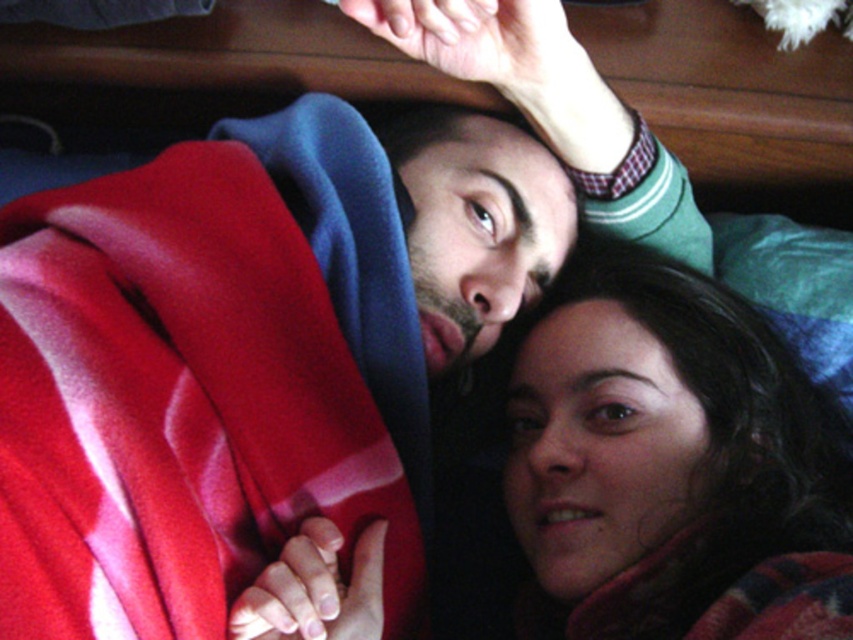
You are a photographer trying to capture a closeup of the smooth skin face at center without the velvety red blanket at upper left blocking the view. Can you adjust your position to achieve this?

The velvety red blanket at upper left is closer to the viewer than the smooth skin face at center, so adjusting your position to move around the blanket would allow you to capture the face without obstruction.

You are a photographer aiming to capture a closeup of the smooth skin face at center without the velvety red blanket at upper left blocking the view. Based on their positions, is it possible to position the camera in a way that avoids the blanket?

The velvety red blanket at upper left is positioned over the smooth skin face at center, so moving the camera angle downward or shifting the camera position lower might allow capturing the face without the blanket obstruction.

You are a photographer trying to capture a closeup shot of the smooth skin face at center while ensuring the velvety red blanket at upper left is still visible in the frame. Given their sizes, do you think you can fit both into the shot without cropping either?

The velvety red blanket at upper left occupies less space than smooth skin face at center, so yes, you can fit both into the shot since the blanket is smaller and the face is larger, allowing enough space for both.